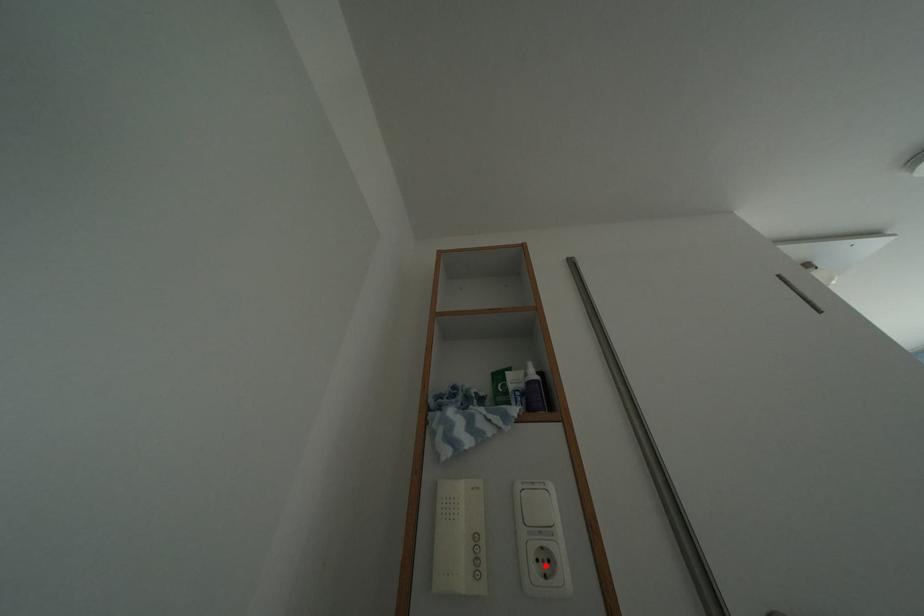
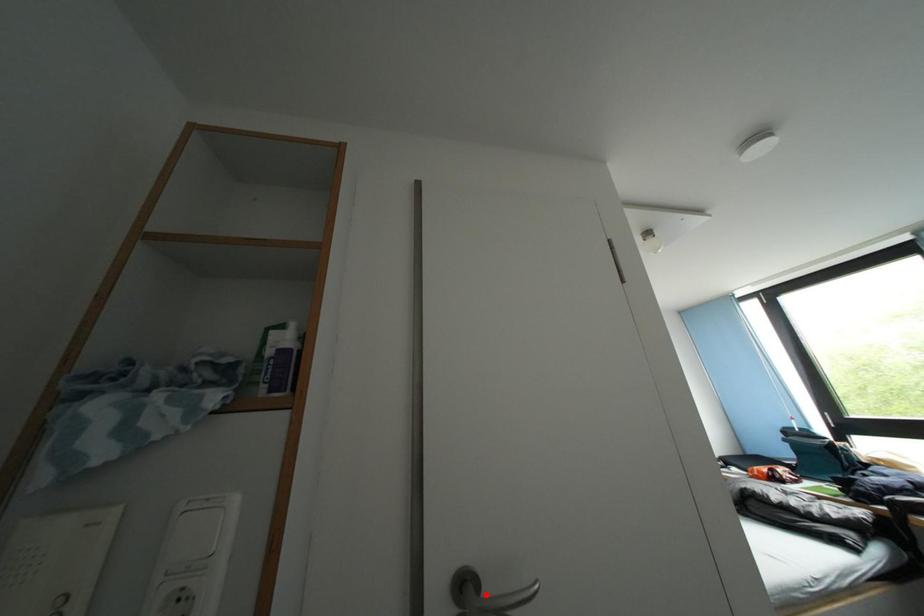
I am providing you with two images of the same scene from different viewpoints. A red point is marked on the first image and another point is marked on the second image. Is the marked point in image1 the same physical position as the marked point in image2?

No